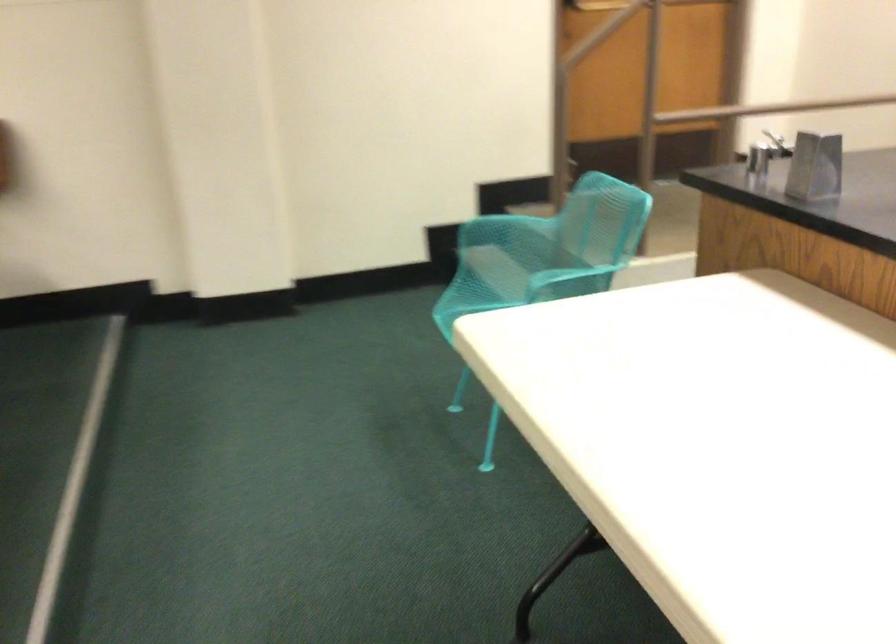
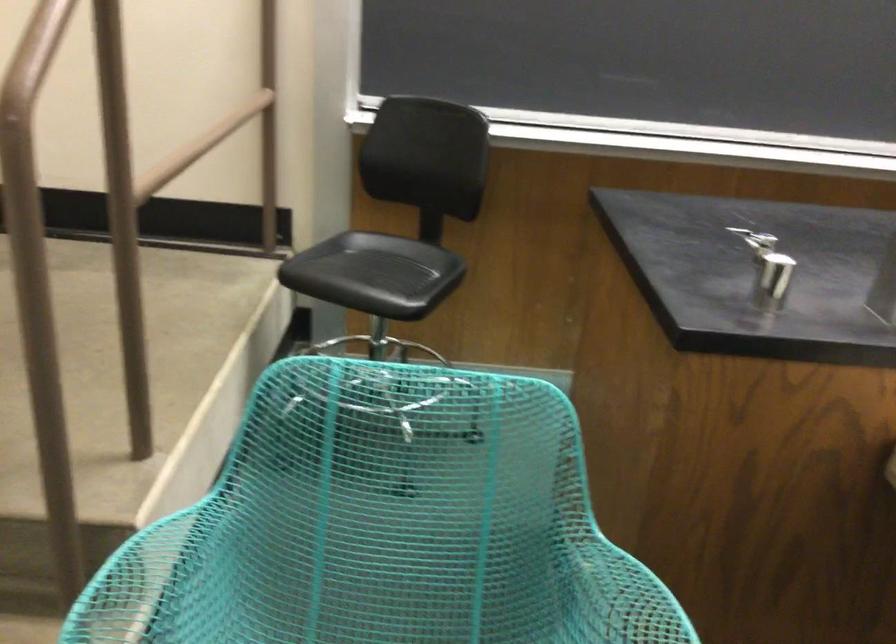
Where in the second image is the point corresponding to (x=496, y=222) from the first image?

(150, 582)